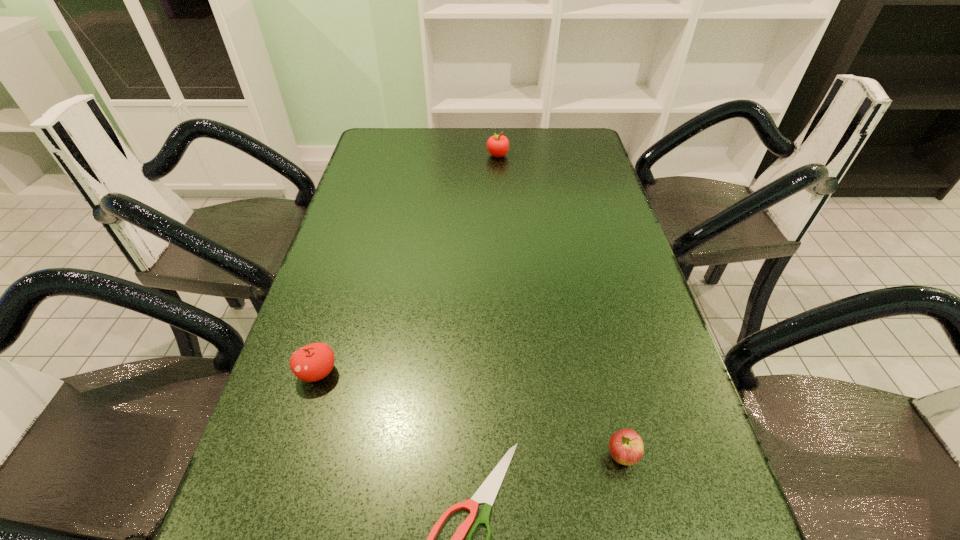
Find the location of a particular element. object at the left edge is located at coordinates (313, 362).

Image resolution: width=960 pixels, height=540 pixels. I want to click on object that is positioned at the right edge, so click(x=626, y=447).

Locate an element on the screen. This screenshot has height=540, width=960. blank space at the far edge is located at coordinates (423, 161).

Image resolution: width=960 pixels, height=540 pixels. Find the location of `free spot at the left edge of the desktop`. free spot at the left edge of the desktop is located at coordinates (406, 173).

You are a GUI agent. You are given a task and a screenshot of the screen. Output one action in this format:
    pyautogui.click(x=<x>, y=<y>)
    Task: Click on the vacant region at the right edge of the desktop
    
    Given the screenshot: What is the action you would take?
    pyautogui.click(x=665, y=364)

Find the location of a particular element. vacant space at the far left corner of the desktop is located at coordinates (375, 148).

Find the location of `vacant space at the far right corner of the desktop`. vacant space at the far right corner of the desktop is located at coordinates (549, 144).

This screenshot has height=540, width=960. I want to click on vacant area between the rightmost object and the farthest object, so click(560, 306).

Identify the location of empty space that is in between the nearest apple and the leftmost object. The height and width of the screenshot is (540, 960). (469, 414).

You are a GUI agent. You are given a task and a screenshot of the screen. Output one action in this format:
    pyautogui.click(x=<x>, y=<y>)
    Task: Click on the free spot between the nearest apple and the farthest object
    The width and height of the screenshot is (960, 540).
    Given the screenshot: What is the action you would take?
    pyautogui.click(x=560, y=306)